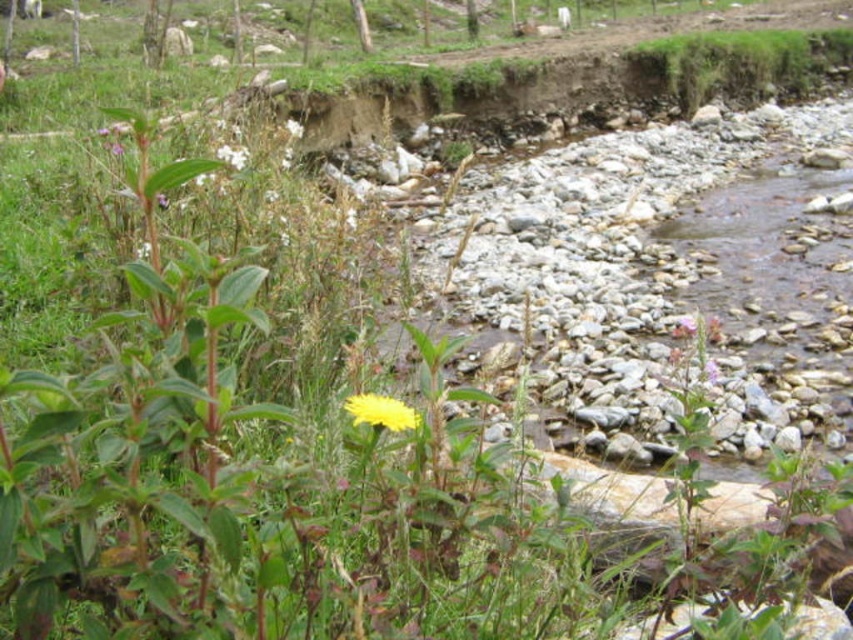
Question: Which of these objects is positioned closest to the yellow matte flower at center?

Choices:
 (A) pink matte flower at center-right
 (B) white fluffy flower at upper left

Answer: (B)

Question: Can you confirm if white fluffy flower at upper left is thinner than pink matte flower at center-right?

Choices:
 (A) yes
 (B) no

Answer: (A)

Question: Can you confirm if white fluffy flower at upper left is wider than pink matte flower at center-right?

Choices:
 (A) yes
 (B) no

Answer: (B)

Question: Which point is closer to the camera?

Choices:
 (A) yellow matte flower at center
 (B) white fluffy flower at upper left
 (C) pink matte flower at center-right

Answer: (A)

Question: Which object is positioned closest to the pink matte flower at center-right?

Choices:
 (A) white fluffy flower at upper left
 (B) yellow matte flower at center

Answer: (A)

Question: Can you confirm if yellow matte flower at center is positioned to the left of pink matte flower at center-right?

Choices:
 (A) no
 (B) yes

Answer: (B)